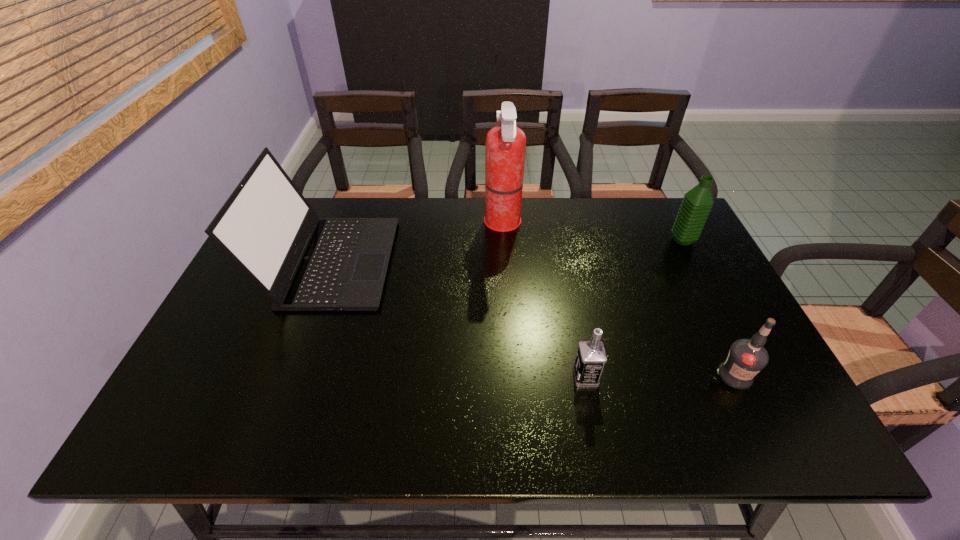
This screenshot has width=960, height=540. I want to click on object that is at the left edge, so click(302, 262).

This screenshot has width=960, height=540. What are the coordinates of `water bottle at the right edge` in the screenshot? It's located at (697, 203).

Find the location of a particular element. vodka that is positioned at the right edge is located at coordinates (746, 358).

Find the location of `object that is at the far left corner`. object that is at the far left corner is located at coordinates (302, 262).

In order to click on object present at the far right corner in this screenshot , I will do `click(697, 203)`.

Locate an element on the screen. This screenshot has height=540, width=960. vacant space at the far edge is located at coordinates (594, 206).

In the image, there is a desktop. Where is `free region at the near edge`? free region at the near edge is located at coordinates coord(697,441).

You are a GUI agent. You are given a task and a screenshot of the screen. Output one action in this format:
    pyautogui.click(x=<x>, y=<y>)
    Task: Click on the vacant space at the left edge of the desktop
    This screenshot has height=540, width=960.
    Given the screenshot: What is the action you would take?
    pyautogui.click(x=235, y=351)

The width and height of the screenshot is (960, 540). Identify the location of vacant space at the right edge. (680, 260).

The width and height of the screenshot is (960, 540). What are the coordinates of `vacant area at the far left corner` in the screenshot? It's located at (320, 204).